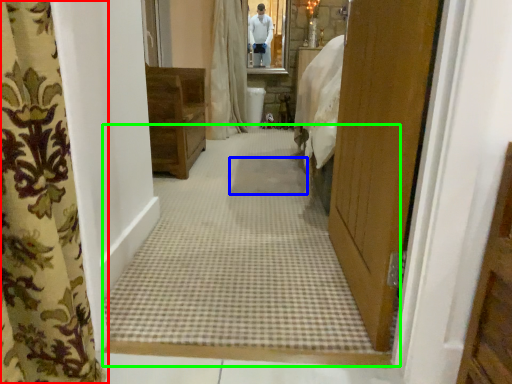
Question: Which is nearer to the curtain (highlighted by a red box)? mat (highlighted by a blue box) or plain (highlighted by a green box).

Choices:
 (A) mat
 (B) plain

Answer: (B)